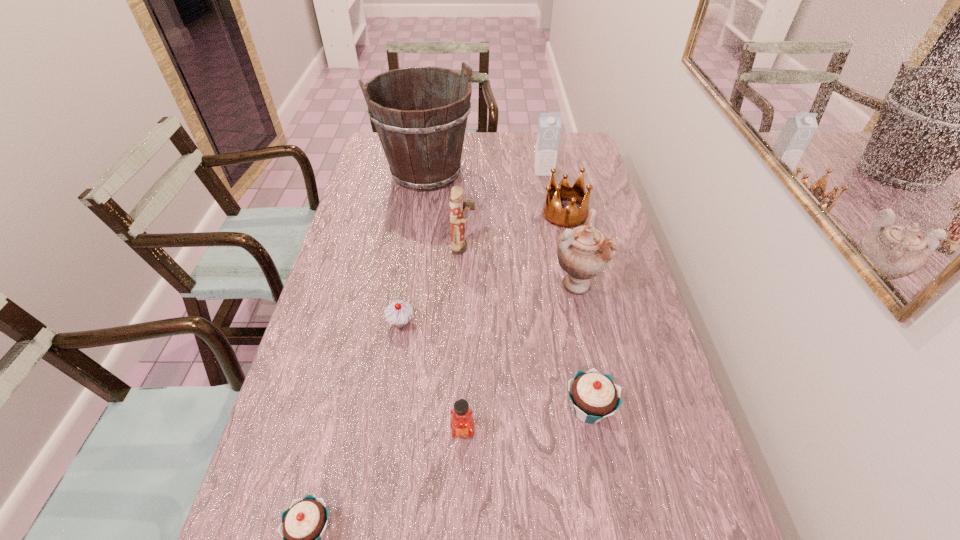
Locate an element on the screen. vacant space located 0.290m on the front of the tallest object is located at coordinates (413, 258).

The width and height of the screenshot is (960, 540). Find the location of `free space located on the front label of the carton`. free space located on the front label of the carton is located at coordinates (552, 212).

Identify the location of vacant space located on the front of the urn. (605, 429).

In order to click on vacant region located 0.210m on the front-facing side of the fourth farthest object in this screenshot , I will do pyautogui.click(x=542, y=247).

Identify the location of vacant space located 0.250m on the left of the fifth tallest object. Image resolution: width=960 pixels, height=540 pixels. (468, 213).

Locate an element on the screen. vacant space located on the right of the farthest cupcake is located at coordinates (564, 322).

The width and height of the screenshot is (960, 540). In order to click on free region located 0.130m on the back of the rightmost cupcake in this screenshot , I will do `click(576, 342)`.

This screenshot has width=960, height=540. What are the coordinates of `free region located on the front label of the honey` in the screenshot? It's located at (460, 524).

The width and height of the screenshot is (960, 540). Identify the location of object that is at the far edge. (422, 135).

Where is `object at the left edge`? The image size is (960, 540). object at the left edge is located at coordinates point(422,135).